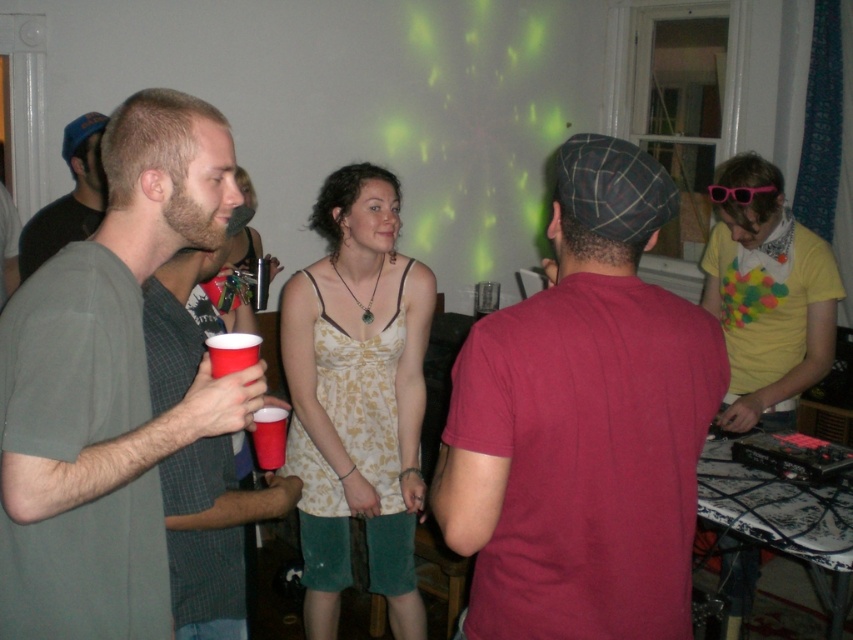
You are a guest at this party and need to grab a drink from the matte plastic cup at left without moving more than 1.5 meters from your current position near the yellow matte shirt at right. Is this possible?

The yellow matte shirt at right and matte plastic cup at left are 1.82 meters apart, so moving 1.5 meters won not be enough to reach the matte plastic cup at left from the yellow matte shirt at right.

You are at a party and need to choose between the matte plastic cup at lower left and the pink plastic goggles at upper right to carry a small amount of liquid. Which object is more suitable for holding liquid?

The matte plastic cup at lower left is thinner than the pink plastic goggles at upper right, so the matte plastic cup at lower left is more suitable for holding liquid because it has a narrower shape designed to contain liquids.